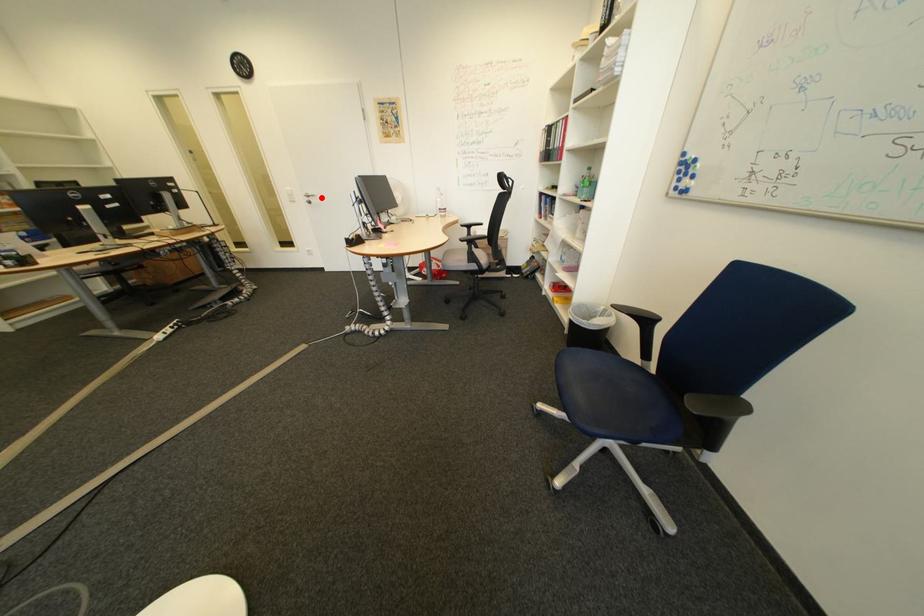
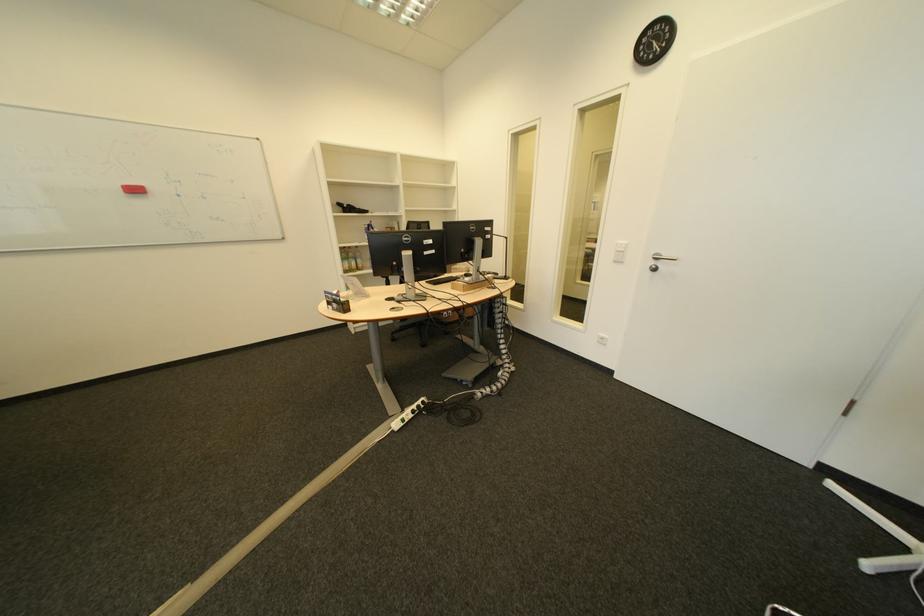
Question: I am providing you with two images of the same scene from different viewpoints. In image1, a red point is highlighted. Considering the same 3D point in image2, which of the following is correct?

Choices:
 (A) It is closer
 (B) It is farther

Answer: (B)